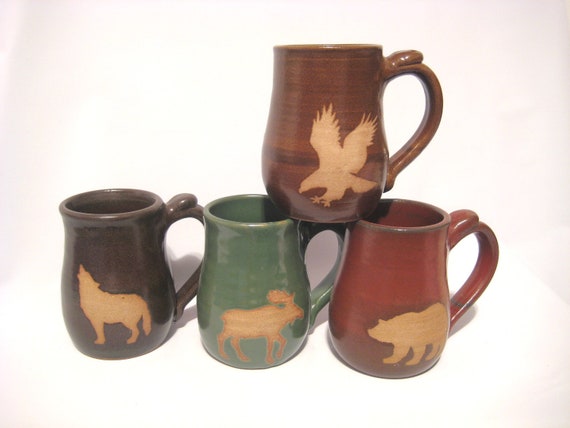
Image resolution: width=570 pixels, height=428 pixels. I want to click on handle, so click(x=484, y=279).